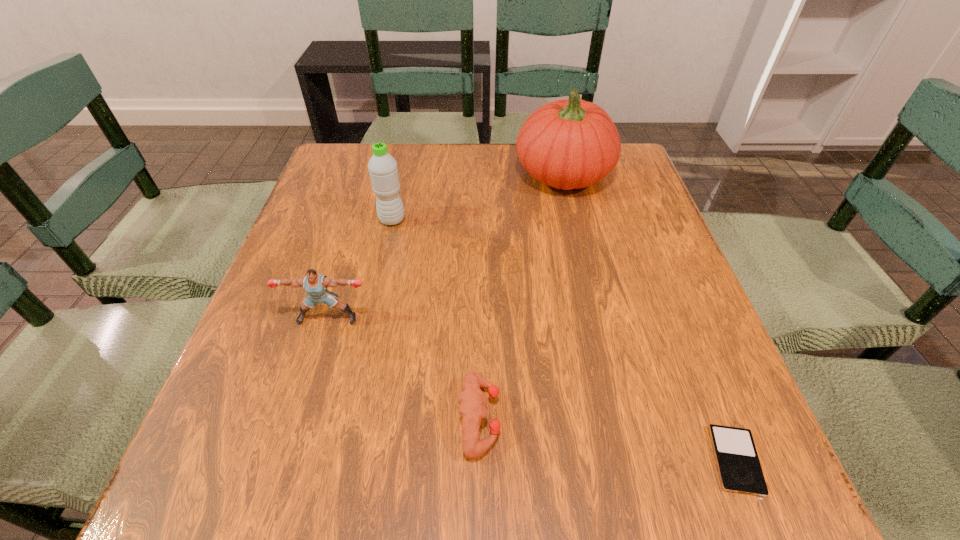
You are a GUI agent. You are given a task and a screenshot of the screen. Output one action in this format:
    pyautogui.click(x=<x>, y=<y>)
    Task: Click on the pumpkin
    
    Given the screenshot: What is the action you would take?
    pyautogui.click(x=568, y=144)

In order to click on water bottle in this screenshot , I will do `click(383, 170)`.

What are the coordinates of `the fourth shortest object` in the screenshot? It's located at tap(383, 170).

Where is `the third shortest object`? the third shortest object is located at coordinates (315, 284).

Find the location of a particular element. the left puncher is located at coordinates (315, 284).

In order to click on the second shortest object in this screenshot , I will do `click(472, 400)`.

Where is `the right puncher`? This screenshot has height=540, width=960. the right puncher is located at coordinates (472, 400).

The height and width of the screenshot is (540, 960). I want to click on iPod, so click(x=739, y=468).

Find the location of a particular element. free location located on the left of the farthest object is located at coordinates (432, 174).

Find the location of `vacant space situated on the front of the fourth shortest object`. vacant space situated on the front of the fourth shortest object is located at coordinates coord(372,312).